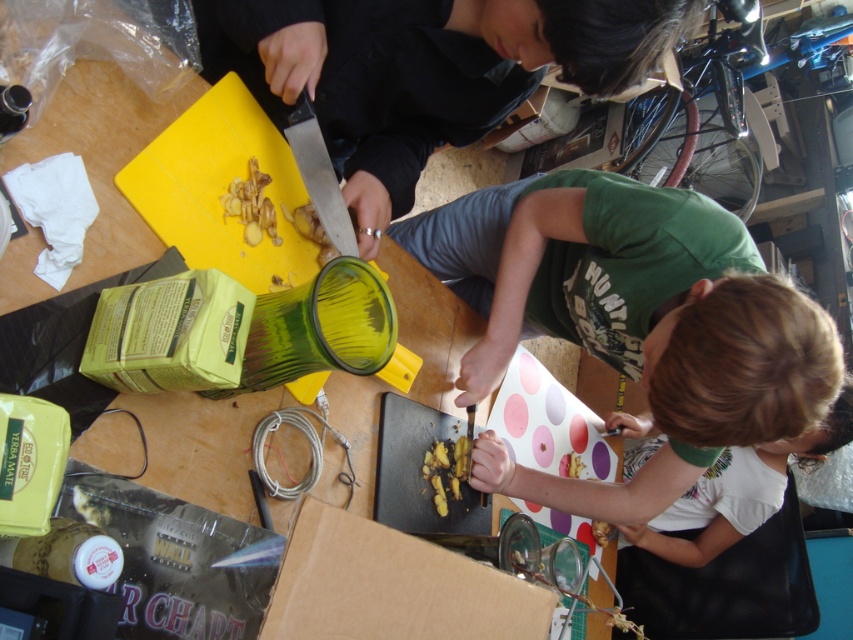
Does yellow rubbery ginger at upper center appear on the right side of brown crumbly food at lower center?

Incorrect, yellow rubbery ginger at upper center is not on the right side of brown crumbly food at lower center.

Does yellow rubbery ginger at upper center have a lesser width compared to brown crumbly food at lower center?

Indeed, yellow rubbery ginger at upper center has a lesser width compared to brown crumbly food at lower center.

Where is `yellow rubbery ginger at upper center`? yellow rubbery ginger at upper center is located at coordinates (251, 205).

Looking at this image, is yellow rubbery food at lower center positioned in front of brown crumbly food at lower center?

Yes, yellow rubbery food at lower center is closer to the viewer.

Can you confirm if yellow rubbery food at lower center is bigger than brown crumbly food at lower center?

Actually, yellow rubbery food at lower center might be smaller than brown crumbly food at lower center.

Where is `yellow rubbery food at lower center`? This screenshot has height=640, width=853. yellow rubbery food at lower center is located at coordinates (570, 465).

Who is more forward, [439,74] or [596,524]?

Positioned in front is point [439,74].

Who is positioned more to the left, green fabric shirt at upper center or brown crumbly food at lower center?

green fabric shirt at upper center is more to the left.

Is point (619, 77) farther from viewer compared to point (607, 536)?

No, it is not.

The image size is (853, 640). In order to click on green fabric shirt at upper center in this screenshot , I will do `click(422, 72)`.